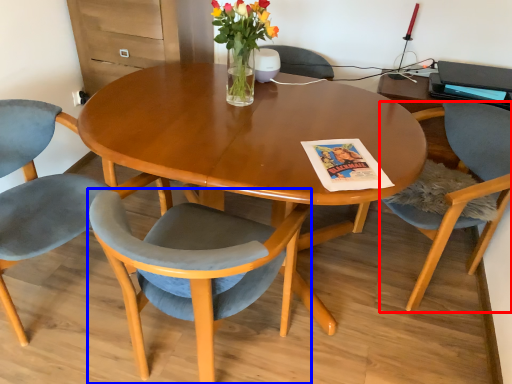
Question: Among these objects, which one is nearest to the camera, chair (highlighted by a red box) or chair (highlighted by a blue box)?

Choices:
 (A) chair
 (B) chair

Answer: (B)